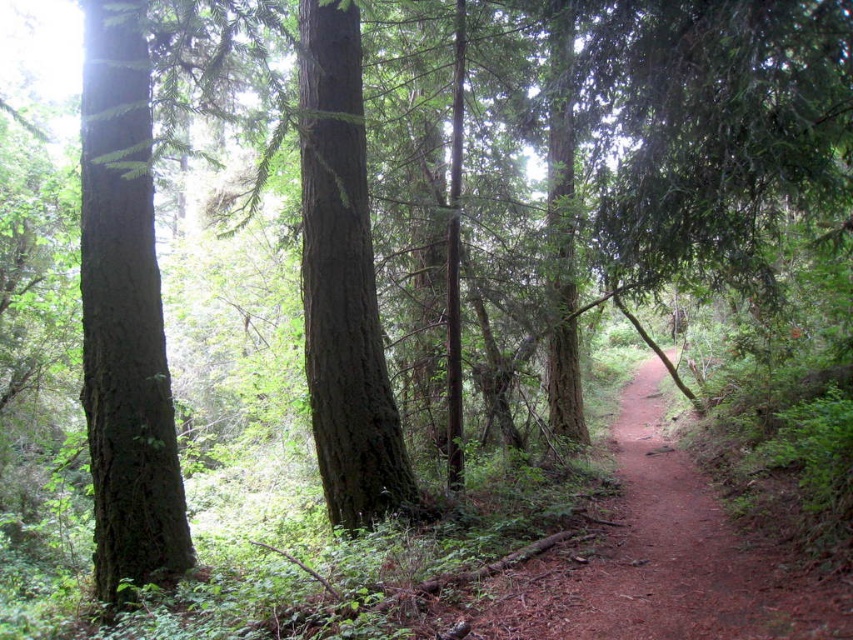
Question: Which point is closer to the camera taking this photo?

Choices:
 (A) (114, 588)
 (B) (601, 557)
 (C) (308, 374)

Answer: (B)

Question: Considering the real-world distances, which object is farthest from the dirt path at center?

Choices:
 (A) green rough bark tree at left
 (B) smooth brown tree trunk at center

Answer: (A)

Question: Does green rough bark tree at left appear over dirt path at center?

Choices:
 (A) no
 (B) yes

Answer: (B)

Question: Based on their relative distances, which object is nearer to the smooth brown tree trunk at center?

Choices:
 (A) green rough bark tree at left
 (B) dirt path at center

Answer: (A)

Question: Does green rough bark tree at left have a lesser width compared to smooth brown tree trunk at center?

Choices:
 (A) no
 (B) yes

Answer: (A)

Question: Is green rough bark tree at left to the right of smooth brown tree trunk at center from the viewer's perspective?

Choices:
 (A) yes
 (B) no

Answer: (B)